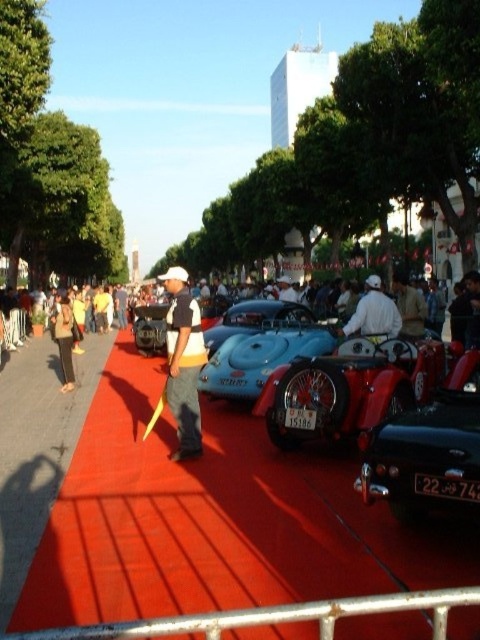
Is point (447, 396) positioned behind point (299, 337)?

No.

Between point (468, 417) and point (312, 339), which one is positioned in front?

Positioned in front is point (468, 417).

Based on the photo, who is more forward, [471,451] or [252,323]?

Point [471,451] is in front.

The height and width of the screenshot is (640, 480). What are the coordinates of `shiny black car at center` in the screenshot? It's located at (425, 458).

What do you see at coordinates (256, 320) in the screenshot? Image resolution: width=480 pixels, height=640 pixels. I see `blue glossy car at center` at bounding box center [256, 320].

Is blue glossy car at center above white cotton shirt at center?

Incorrect, blue glossy car at center is not positioned above white cotton shirt at center.

Identify the location of blue glossy car at center. Image resolution: width=480 pixels, height=640 pixels. (256, 320).

Can you confirm if matte white cap at center is wider than dark brown pants at left?

Yes.

Which of these two, matte white cap at center or dark brown pants at left, stands shorter?

dark brown pants at left is shorter.

The width and height of the screenshot is (480, 640). I want to click on matte white cap at center, so click(183, 362).